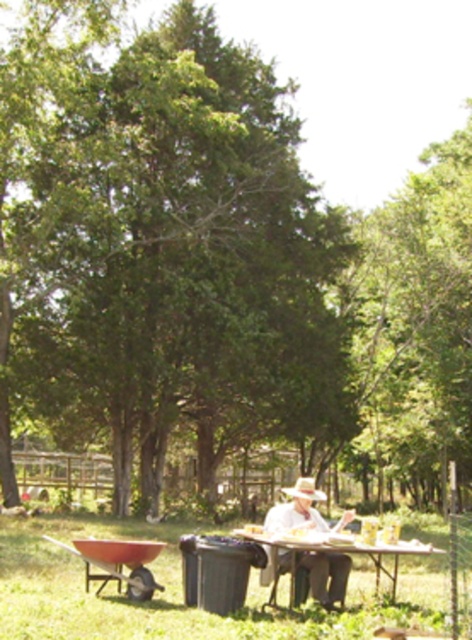
Between green grass at lower center and white plastic table at center, which one is positioned lower?

Positioned lower is green grass at lower center.

Is green grass at lower center closer to camera compared to white plastic table at center?

Yes, it is.

Which is in front, point (278, 621) or point (278, 534)?

Point (278, 621)

Find the location of a particular element. Image resolution: width=472 pixels, height=640 pixels. green grass at lower center is located at coordinates (180, 593).

Between white clothed person at center and white plastic table at center, which one is positioned lower?

white clothed person at center is below.

Which is behind, point (323, 592) or point (301, 544)?

The point (323, 592) is behind.

Does point (337, 588) come behind point (423, 552)?

Yes, it is.

Where is `white clothed person at center`? The width and height of the screenshot is (472, 640). white clothed person at center is located at coordinates (303, 509).

Can you confirm if white plastic table at center is positioned to the left of white straw hat at center?

Yes, white plastic table at center is to the left of white straw hat at center.

Is point (264, 604) positioned after point (300, 492)?

No, it is in front of (300, 492).

Who is more distant from viewer, (303, 545) or (304, 481)?

The point (304, 481) is behind.

This screenshot has height=640, width=472. I want to click on white plastic table at center, so click(x=331, y=552).